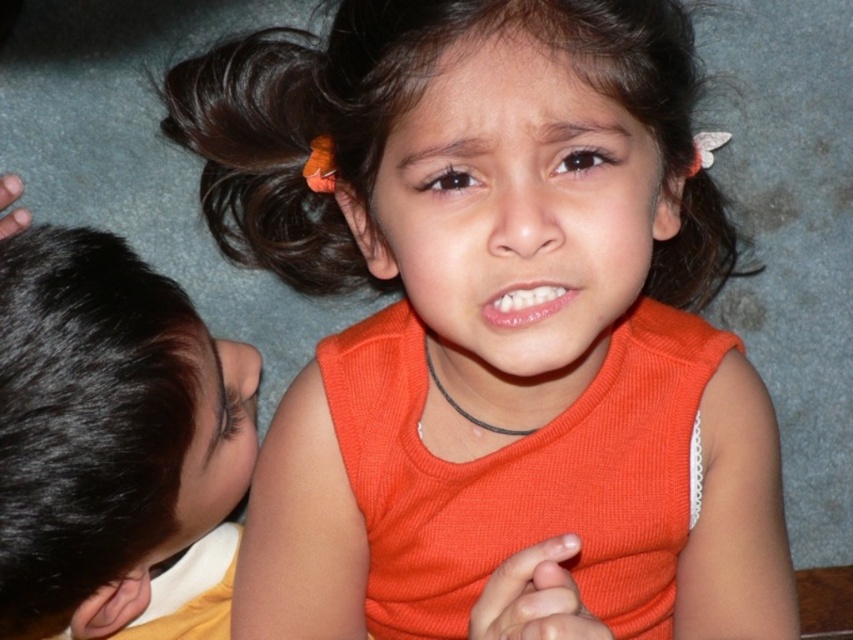
You are a photographer trying to capture a closeup of the child in the foreground. You notice two points marked in the image at coordinates point (241, 442) and point (422, 54). Which point should you focus on to ensure the foreground child is sharp?

Point (241, 442) is further to the camera than point (422, 54), so you should focus on point (241, 442) to ensure the foreground child is sharp.

Consider the image. You are a photographer trying to capture a group photo of the black hair at left and brown matte hair at upper center. Based on their positions, which child should you ask to move to the right to ensure both are centered in the frame?

The black hair at left is to the left of brown matte hair at upper center, so you should ask the black hair at left to move to the right to align both in the center.

You are a photographer trying to capture a closeup of the black hair at left and brown matte hair at upper center. Which hair strand is narrower when viewed from your camera position?

The black hair at left is narrower than the brown matte hair at upper center because its width is less than the latter.